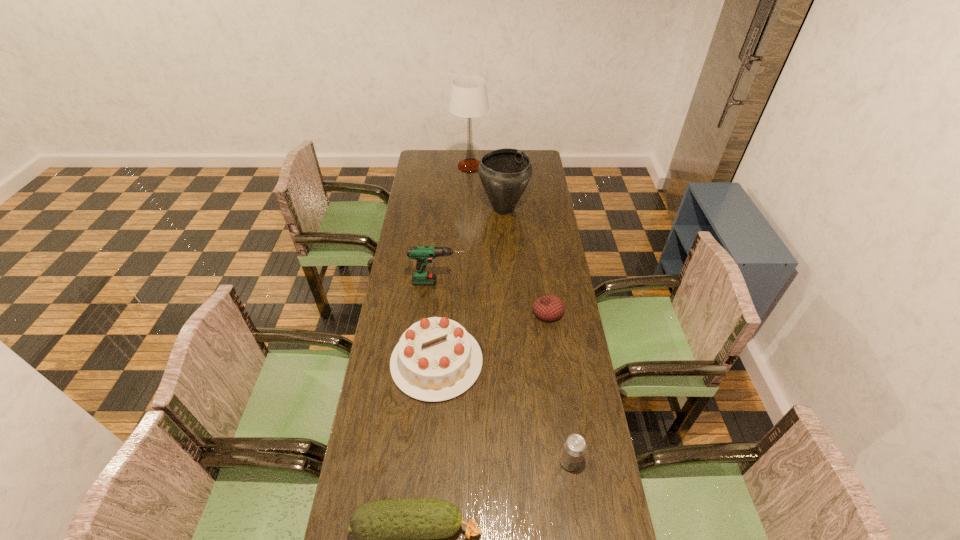
Where is `beanbag`? This screenshot has height=540, width=960. beanbag is located at coordinates (548, 308).

Where is `the shortest object`? This screenshot has width=960, height=540. the shortest object is located at coordinates (548, 308).

Find the location of a particular element. Image resolution: width=960 pixels, height=540 pixels. free spot located above the cylindrical shade of the farthest object is located at coordinates (510, 166).

What are the coordinates of `vacant area situated 0.080m on the back of the second tallest object` in the screenshot? It's located at (502, 185).

Where is `free space located 0.330m on the handle side of the third farthest object`? The width and height of the screenshot is (960, 540). free space located 0.330m on the handle side of the third farthest object is located at coordinates (545, 282).

Identify the location of free region located 0.130m on the right of the fourth shortest object. (519, 362).

Where is `blank space located on the left of the beer can`? Image resolution: width=960 pixels, height=540 pixels. blank space located on the left of the beer can is located at coordinates (434, 461).

Locate an element on the screen. The height and width of the screenshot is (540, 960). free region located on the left of the fourth farthest object is located at coordinates (473, 312).

Where is `object present at the far edge`? The height and width of the screenshot is (540, 960). object present at the far edge is located at coordinates (469, 98).

Identify the location of drill at the left edge. The height and width of the screenshot is (540, 960). (423, 254).